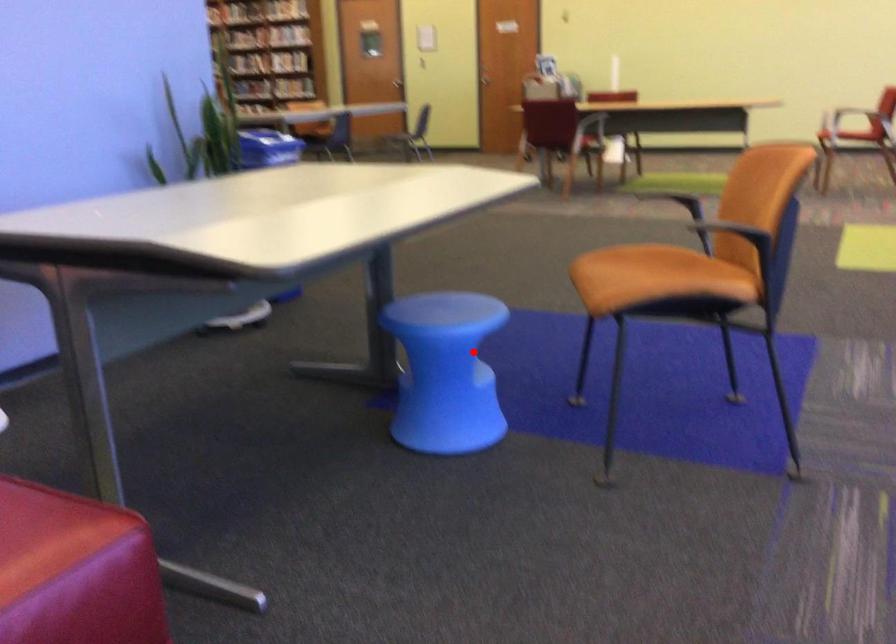
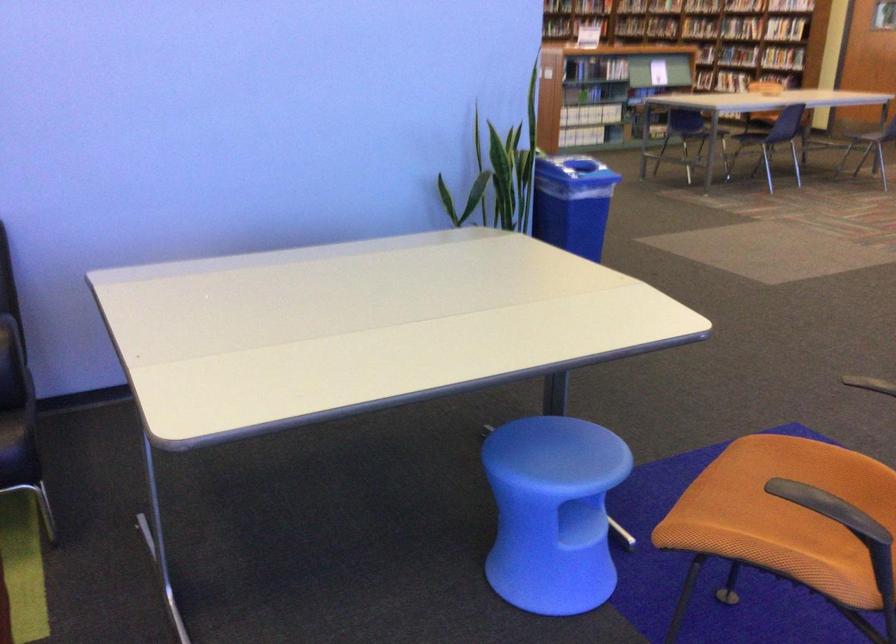
Where in the second image is the point corresponding to the highlighted location from the first image?

(553, 512)